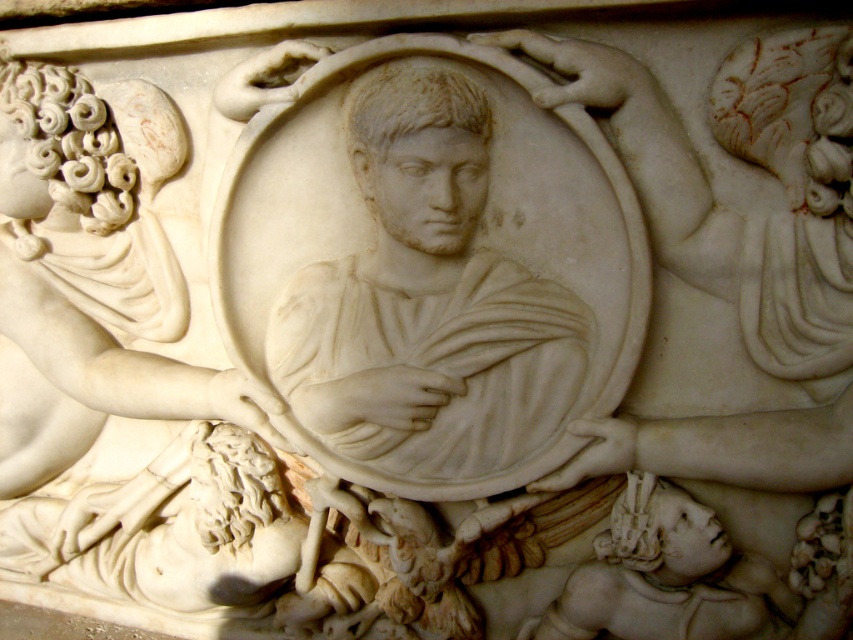
Between point (416, 291) and point (51, 364), which one is positioned in front?

Positioned in front is point (416, 291).

Is white marble bust at center to the left of white marble deity at center from the viewer's perspective?

No, white marble bust at center is not to the left of white marble deity at center.

Is point (395, 328) farther from camera compared to point (45, 452)?

That is False.

At what (x,y) coordinates should I click in order to perform the action: click on white marble bust at center. Please return your answer as a coordinate pair (x, y). Looking at the image, I should click on (426, 304).